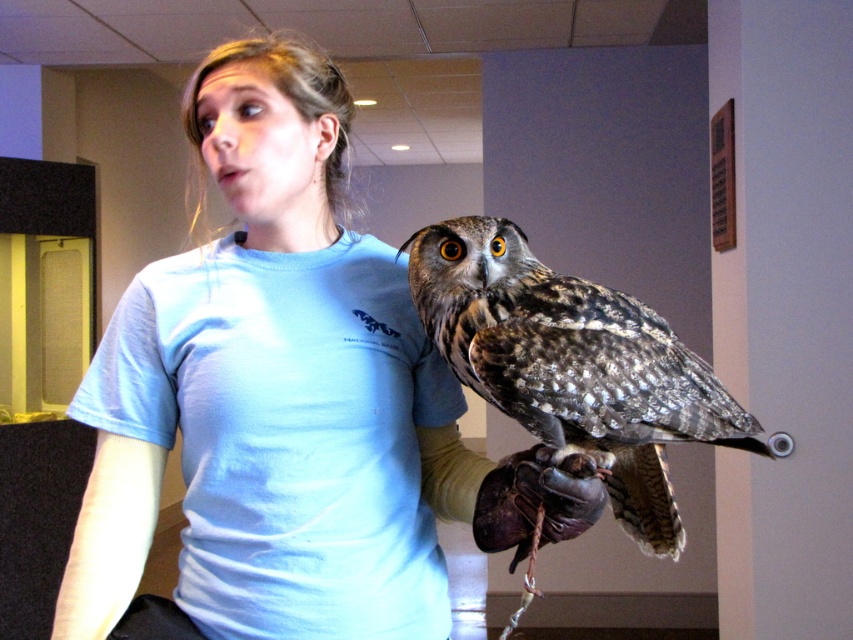
You are standing in a room with two points marked on the floor. The first point is at coordinates point (193, 509) and the second is at point (585, 486). If you face the direction of the first point, which point would be behind you?

Point (193, 509) is behind point (585, 486), so if you face the first point, the second point would be behind you.

You are a delivery robot that needs to place a small package between the light blue fabric at upper left and the leather glove at center. The package is 16 inches long. Can the package fit in the space between them?

The distance between the light blue fabric at upper left and the leather glove at center is 17.31 inches. Since the package is 16 inches long, it can fit in the space between them because 16 inches is shorter than 17.31 inches.